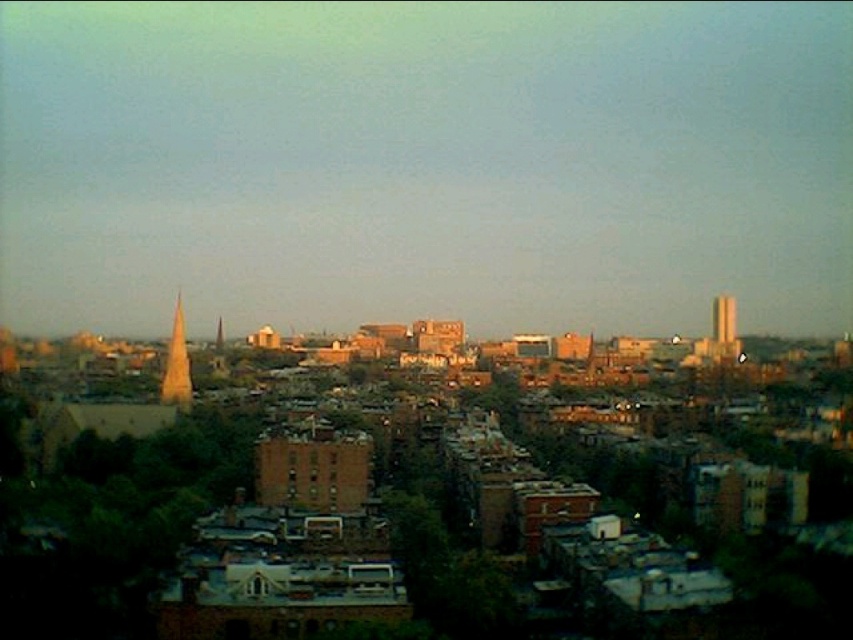
What do you see at coordinates (177, 364) in the screenshot? The height and width of the screenshot is (640, 853). I see `golden glass spire at left` at bounding box center [177, 364].

Who is higher up, golden glass spire at left or brick tower at right?

brick tower at right

You are a GUI agent. You are given a task and a screenshot of the screen. Output one action in this format:
    pyautogui.click(x=<x>, y=<y>)
    Task: Click on the golden glass spire at left
    This screenshot has height=640, width=853.
    Given the screenshot: What is the action you would take?
    pyautogui.click(x=177, y=364)

Which of these two, golden glass spire at left or smooth gold spire at left, stands taller?

With more height is golden glass spire at left.

Can you confirm if golden glass spire at left is shorter than smooth gold spire at left?

In fact, golden glass spire at left may be taller than smooth gold spire at left.

Does point (183, 381) come in front of point (219, 337)?

Yes, it is in front of point (219, 337).

This screenshot has width=853, height=640. In order to click on golden glass spire at left in this screenshot , I will do `click(177, 364)`.

Between point (733, 305) and point (221, 342), which one is positioned behind?

Positioned behind is point (221, 342).

Who is higher up, brick tower at right or smooth gold spire at left?

brick tower at right is higher up.

Which is behind, point (718, 332) or point (215, 336)?

Positioned behind is point (215, 336).

This screenshot has width=853, height=640. Find the location of `brick tower at right`. brick tower at right is located at coordinates (723, 320).